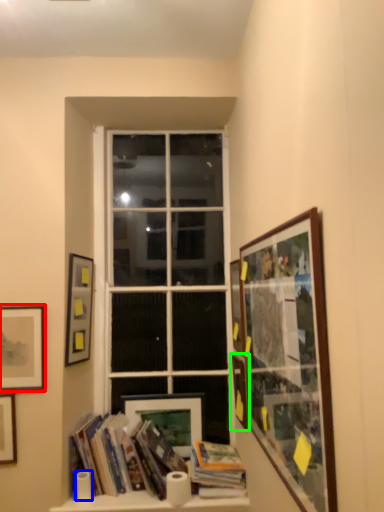
Question: Considering the real-world distances, which object is farthest from picture frame (highlighted by a red box)? toilet paper (highlighted by a blue box) or picture frame (highlighted by a green box)?

Choices:
 (A) toilet paper
 (B) picture frame

Answer: (B)